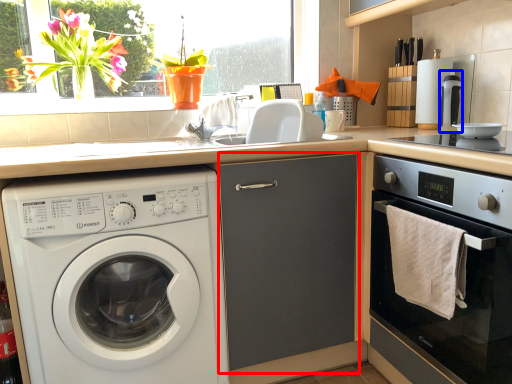
Question: Among these objects, which one is farthest to the camera, screen door (highlighted by a red box) or coffee machine (highlighted by a blue box)?

Choices:
 (A) screen door
 (B) coffee machine

Answer: (B)